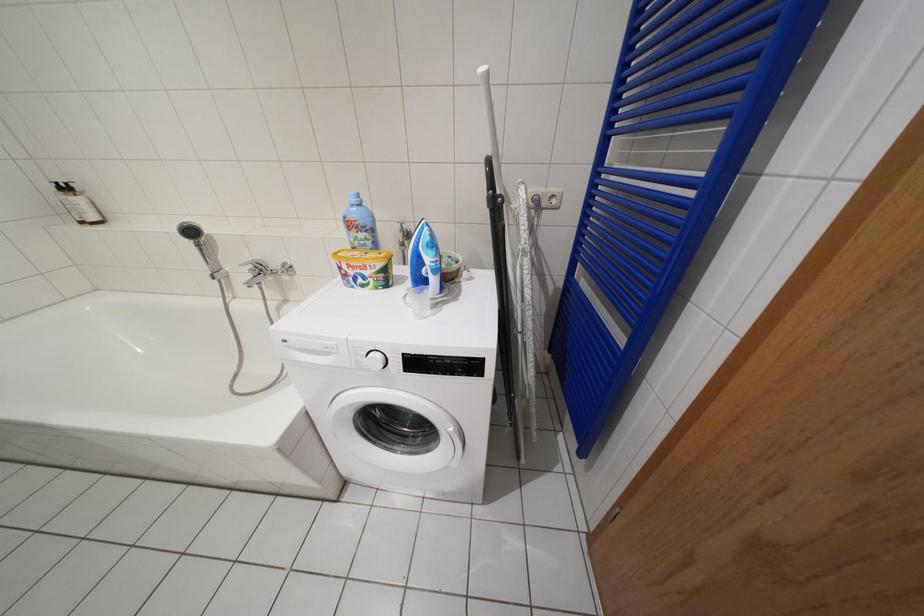
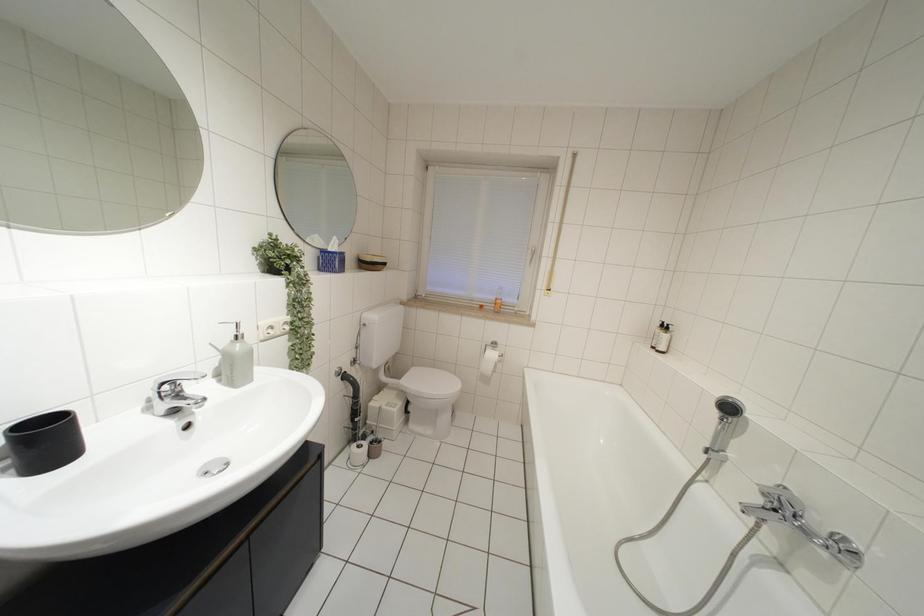
Question: The first image is from the beginning of the video and the second image is from the end. How did the camera likely rotate when shooting the video?

Choices:
 (A) Left
 (B) Right
 (C) Up
 (D) Down

Answer: (A)